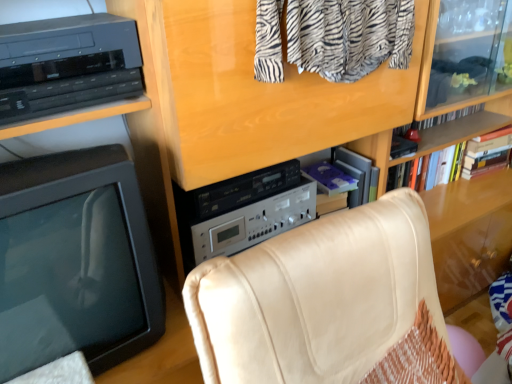
Question: Is black plastic television at left positioned with its back to black plastic shelf at upper left?

Choices:
 (A) yes
 (B) no

Answer: (B)

Question: Could you tell me if black plastic television at left is turned towards black plastic shelf at upper left?

Choices:
 (A) no
 (B) yes

Answer: (A)

Question: Is black plastic television at left further to camera compared to black plastic shelf at upper left?

Choices:
 (A) no
 (B) yes

Answer: (A)

Question: From a real-world perspective, is black plastic television at left on top of black plastic shelf at upper left?

Choices:
 (A) yes
 (B) no

Answer: (B)

Question: Is black plastic television at left thinner than black plastic shelf at upper left?

Choices:
 (A) yes
 (B) no

Answer: (B)

Question: Does black plastic television at left lie in front of black plastic shelf at upper left?

Choices:
 (A) no
 (B) yes

Answer: (B)

Question: Is black plastic shelf at upper left at the back of purple matte book at center, the first book when ordered from left to right?

Choices:
 (A) yes
 (B) no

Answer: (B)

Question: Considering the relative sizes of purple matte book at center, the first book when ordered from left to right, and black plastic shelf at upper left in the image provided, is purple matte book at center, the first book when ordered from left to right, taller than black plastic shelf at upper left?

Choices:
 (A) no
 (B) yes

Answer: (A)

Question: Is purple matte book at center, the first book when ordered from left to right, to the right of black plastic shelf at upper left from the viewer's perspective?

Choices:
 (A) no
 (B) yes

Answer: (B)

Question: Is purple matte book at center, which is the third book from right to left, next to black plastic shelf at upper left?

Choices:
 (A) yes
 (B) no

Answer: (B)

Question: From a real-world perspective, is purple matte book at center, the first book when ordered from left to right, positioned over black plastic shelf at upper left based on gravity?

Choices:
 (A) yes
 (B) no

Answer: (B)

Question: Is hardcover book at upper right, arranged as the 3th book when viewed from the left, aimed at purple matte book at center, which is the third book from right to left?

Choices:
 (A) yes
 (B) no

Answer: (B)